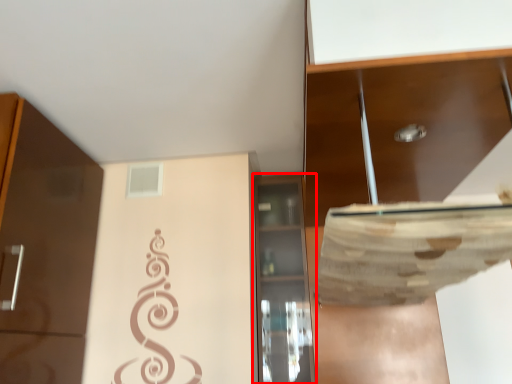
Question: From the image's perspective, considering the relative positions of cabinetry (annotated by the red box) and cabinetry in the image provided, where is cabinetry (annotated by the red box) located with respect to the staircase?

Choices:
 (A) below
 (B) above

Answer: (A)